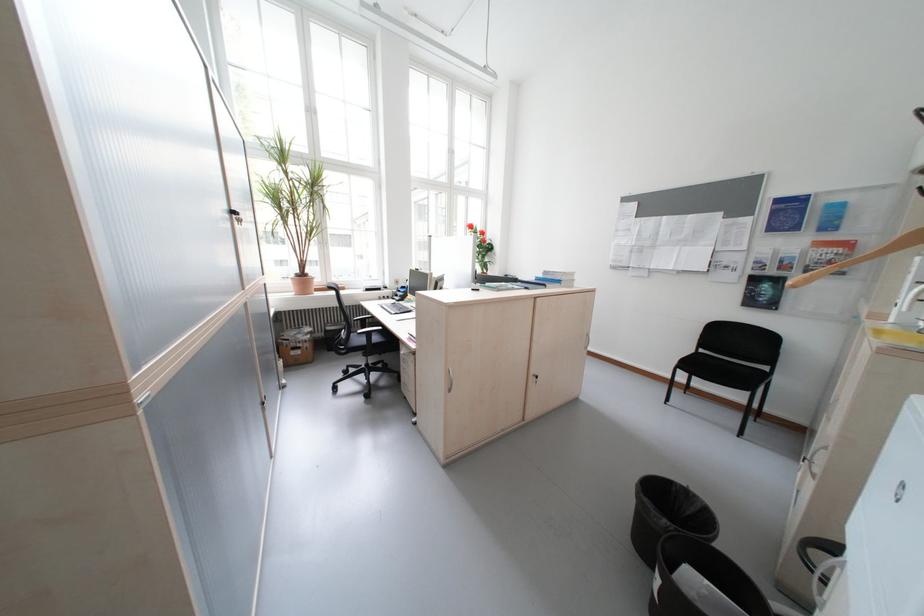
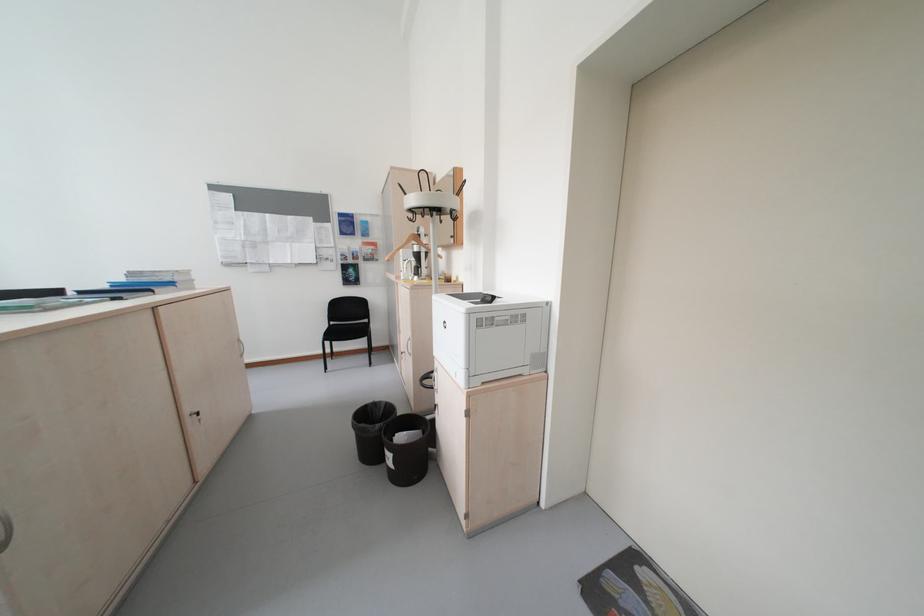
Find the pixel in the second image that matches the point at 711,352 in the first image.

(343, 323)